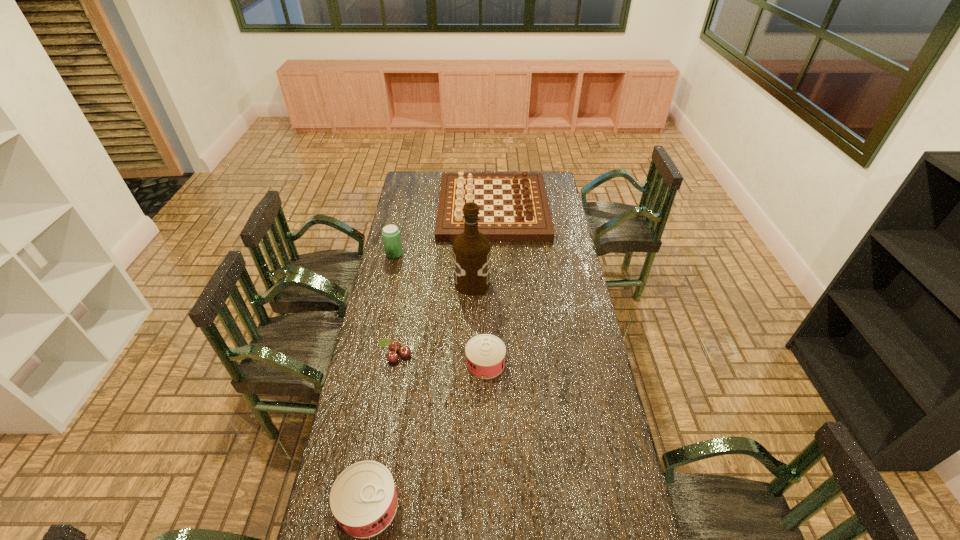
Where is `soda that is at the left edge`? The image size is (960, 540). soda that is at the left edge is located at coordinates (391, 236).

The height and width of the screenshot is (540, 960). What are the coordinates of `cherry that is at the left edge` in the screenshot? It's located at (404, 351).

Where is `object positioned at the right edge`? This screenshot has width=960, height=540. object positioned at the right edge is located at coordinates (525, 215).

Where is `object that is at the near left corner`? The height and width of the screenshot is (540, 960). object that is at the near left corner is located at coordinates (363, 499).

Identify the location of object that is positioned at the far right corner. This screenshot has height=540, width=960. (525, 215).

You are a GUI agent. You are given a task and a screenshot of the screen. Output one action in this format:
    pyautogui.click(x=<x>, y=<y>)
    Task: Click on the free point at the left edge
    
    Given the screenshot: What is the action you would take?
    pyautogui.click(x=387, y=298)

Where is `vacant space at the right edge of the desktop`? Image resolution: width=960 pixels, height=540 pixels. vacant space at the right edge of the desktop is located at coordinates (574, 309).

Where is `free space at the far left corner of the desktop`? free space at the far left corner of the desktop is located at coordinates (420, 183).

This screenshot has height=540, width=960. What are the coordinates of `free space at the far right corner of the desktop` in the screenshot? It's located at (545, 173).

Find the location of a particular element. This screenshot has width=960, height=540. vacant point located between the cherry and the taller can is located at coordinates (382, 430).